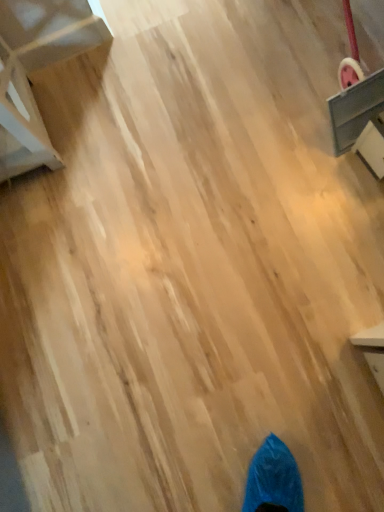
What do you see at coordinates (35, 69) in the screenshot? The image size is (384, 512). I see `white matte chair at upper left, the second furniture viewed from the right` at bounding box center [35, 69].

What is the approximate width of white matte chair at upper left, the second furniture viewed from the right?

It is 13.04 inches.

Where is `white matte chair at upper left, the second furniture viewed from the right`? white matte chair at upper left, the second furniture viewed from the right is located at coordinates (35, 69).

The image size is (384, 512). Describe the element at coordinates (359, 115) in the screenshot. I see `gray fabric drawer at upper right, arranged as the 1th furniture when viewed from the right` at that location.

Measure the distance between point (374, 84) and camera.

37.72 inches.

You are a GUI agent. You are given a task and a screenshot of the screen. Output one action in this format:
    pyautogui.click(x=<x>, y=<y>)
    Task: Click on the gray fabric drawer at upper right, arranged as the 1th furniture when viewed from the right
    The image size is (384, 512).
    Given the screenshot: What is the action you would take?
    pyautogui.click(x=359, y=115)

Identify the location of white matte chair at upper left, the second furniture viewed from the right. (35, 69).

Which object is positioned more to the right, gray fabric drawer at upper right, positioned as the 2th furniture in left-to-right order, or white matte chair at upper left, the second furniture viewed from the right?

gray fabric drawer at upper right, positioned as the 2th furniture in left-to-right order, is more to the right.

Does gray fabric drawer at upper right, positioned as the 2th furniture in left-to-right order, come behind white matte chair at upper left, the second furniture viewed from the right?

Yes, gray fabric drawer at upper right, positioned as the 2th furniture in left-to-right order, is behind white matte chair at upper left, the second furniture viewed from the right.

Is point (360, 141) closer to camera compared to point (36, 146)?

No, (360, 141) is further to viewer.

From the image's perspective, is gray fabric drawer at upper right, arranged as the 1th furniture when viewed from the right, above or below white matte chair at upper left, positioned as the 1th furniture in left-to-right order?

gray fabric drawer at upper right, arranged as the 1th furniture when viewed from the right, is situated higher than white matte chair at upper left, positioned as the 1th furniture in left-to-right order, in the image.

From a real-world perspective, is gray fabric drawer at upper right, arranged as the 1th furniture when viewed from the right, above or below white matte chair at upper left, positioned as the 1th furniture in left-to-right order?

Clearly, from a real-world perspective, gray fabric drawer at upper right, arranged as the 1th furniture when viewed from the right, is below white matte chair at upper left, positioned as the 1th furniture in left-to-right order.

Considering the sizes of objects gray fabric drawer at upper right, positioned as the 2th furniture in left-to-right order, and white matte chair at upper left, the second furniture viewed from the right, in the image provided, who is thinner, gray fabric drawer at upper right, positioned as the 2th furniture in left-to-right order, or white matte chair at upper left, the second furniture viewed from the right,?

Thinner between the two is white matte chair at upper left, the second furniture viewed from the right.

Does gray fabric drawer at upper right, arranged as the 1th furniture when viewed from the right, have a greater height compared to white matte chair at upper left, the second furniture viewed from the right?

Yes.

Which of these two, gray fabric drawer at upper right, arranged as the 1th furniture when viewed from the right, or white matte chair at upper left, the second furniture viewed from the right, is bigger?

white matte chair at upper left, the second furniture viewed from the right, is bigger.

Is white matte chair at upper left, the second furniture viewed from the right, inside gray fabric drawer at upper right, arranged as the 1th furniture when viewed from the right?

No, white matte chair at upper left, the second furniture viewed from the right, is not a part of gray fabric drawer at upper right, arranged as the 1th furniture when viewed from the right.

Is gray fabric drawer at upper right, positioned as the 2th furniture in left-to-right order, beside white matte chair at upper left, positioned as the 1th furniture in left-to-right order?

gray fabric drawer at upper right, positioned as the 2th furniture in left-to-right order, and white matte chair at upper left, positioned as the 1th furniture in left-to-right order, are not in contact.

Could you tell me if gray fabric drawer at upper right, arranged as the 1th furniture when viewed from the right, is turned towards white matte chair at upper left, the second furniture viewed from the right?

No, gray fabric drawer at upper right, arranged as the 1th furniture when viewed from the right, is not oriented towards white matte chair at upper left, the second furniture viewed from the right.

What's the angular difference between gray fabric drawer at upper right, arranged as the 1th furniture when viewed from the right, and white matte chair at upper left, the second furniture viewed from the right,'s facing directions?

There is a 84.6-degree angle between the facing directions of gray fabric drawer at upper right, arranged as the 1th furniture when viewed from the right, and white matte chair at upper left, the second furniture viewed from the right.

Locate an element on the screen. furniture on the left of the gray fabric drawer at upper right, positioned as the 2th furniture in left-to-right order is located at coordinates (35, 69).

Does white matte chair at upper left, the second furniture viewed from the right, appear on the right side of gray fabric drawer at upper right, positioned as the 2th furniture in left-to-right order?

No.

From the picture: In the image, is white matte chair at upper left, the second furniture viewed from the right, positioned in front of or behind gray fabric drawer at upper right, positioned as the 2th furniture in left-to-right order?

Clearly, white matte chair at upper left, the second furniture viewed from the right, is in front of gray fabric drawer at upper right, positioned as the 2th furniture in left-to-right order.

Is point (22, 54) farther from viewer compared to point (371, 168)?

That is True.

From the image's perspective, between white matte chair at upper left, positioned as the 1th furniture in left-to-right order, and gray fabric drawer at upper right, arranged as the 1th furniture when viewed from the right, who is located below?

From the image's view, white matte chair at upper left, positioned as the 1th furniture in left-to-right order, is below.

From a real-world perspective, does white matte chair at upper left, positioned as the 1th furniture in left-to-right order, sit lower than gray fabric drawer at upper right, arranged as the 1th furniture when viewed from the right?

No, from a real-world perspective, white matte chair at upper left, positioned as the 1th furniture in left-to-right order, is not beneath gray fabric drawer at upper right, arranged as the 1th furniture when viewed from the right.

Looking at this image, considering the sizes of objects white matte chair at upper left, positioned as the 1th furniture in left-to-right order, and gray fabric drawer at upper right, positioned as the 2th furniture in left-to-right order, in the image provided, who is wider, white matte chair at upper left, positioned as the 1th furniture in left-to-right order, or gray fabric drawer at upper right, positioned as the 2th furniture in left-to-right order,?

Answer: Wider between the two is gray fabric drawer at upper right, positioned as the 2th furniture in left-to-right order.

Is white matte chair at upper left, the second furniture viewed from the right, taller than gray fabric drawer at upper right, positioned as the 2th furniture in left-to-right order?

No, white matte chair at upper left, the second furniture viewed from the right, is not taller than gray fabric drawer at upper right, positioned as the 2th furniture in left-to-right order.

Considering the sizes of white matte chair at upper left, positioned as the 1th furniture in left-to-right order, and gray fabric drawer at upper right, positioned as the 2th furniture in left-to-right order, in the image, is white matte chair at upper left, positioned as the 1th furniture in left-to-right order, bigger or smaller than gray fabric drawer at upper right, positioned as the 2th furniture in left-to-right order,?

In the image, white matte chair at upper left, positioned as the 1th furniture in left-to-right order, appears to be larger than gray fabric drawer at upper right, positioned as the 2th furniture in left-to-right order.

Is white matte chair at upper left, positioned as the 1th furniture in left-to-right order, not inside gray fabric drawer at upper right, positioned as the 2th furniture in left-to-right order?

That's correct, white matte chair at upper left, positioned as the 1th furniture in left-to-right order, is outside of gray fabric drawer at upper right, positioned as the 2th furniture in left-to-right order.

Is white matte chair at upper left, positioned as the 1th furniture in left-to-right order, far away from gray fabric drawer at upper right, arranged as the 1th furniture when viewed from the right?

No.

Is white matte chair at upper left, positioned as the 1th furniture in left-to-right order, facing towards gray fabric drawer at upper right, positioned as the 2th furniture in left-to-right order?

No, white matte chair at upper left, positioned as the 1th furniture in left-to-right order, is not facing towards gray fabric drawer at upper right, positioned as the 2th furniture in left-to-right order.

Identify the location of furniture above the white matte chair at upper left, positioned as the 1th furniture in left-to-right order (from the image's perspective). (359, 115).

Find the location of a particular element. furniture directly beneath the white matte chair at upper left, positioned as the 1th furniture in left-to-right order (from a real-world perspective) is located at coordinates (359, 115).

Where is `furniture lying in front of the gray fabric drawer at upper right, arranged as the 1th furniture when viewed from the right`? Image resolution: width=384 pixels, height=512 pixels. furniture lying in front of the gray fabric drawer at upper right, arranged as the 1th furniture when viewed from the right is located at coordinates (35, 69).